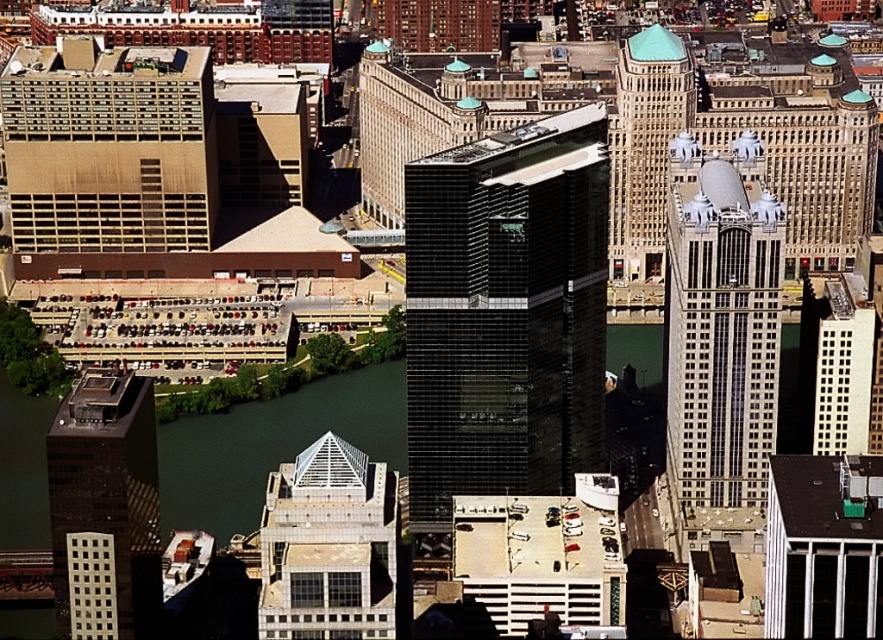
Measure the distance between point (570, 376) and camera.

Point (570, 376) and camera are 648.33 meters apart.

Is black glass skyscraper at center further to camera compared to matte glass skyscraper at upper right?

No.

What are the coordinates of `black glass skyscraper at center` in the screenshot? It's located at (506, 314).

Is point (518, 467) closer to camera compared to point (272, 518)?

Yes.

Does black glass skyscraper at center lie behind glass pyramid at center?

No.

Who is more forward, [512,376] or [336,540]?

Point [512,376] is in front.

Identify the location of black glass skyscraper at center. Image resolution: width=883 pixels, height=640 pixels. (506, 314).

Does matte glass skyscraper at upper right appear on the left side of white glass building at center-right?

Indeed, matte glass skyscraper at upper right is positioned on the left side of white glass building at center-right.

Between point (620, 115) and point (834, 356), which one is positioned in front?

Point (620, 115) is in front.

In order to click on matte glass skyscraper at upper right in this screenshot , I will do `click(645, 145)`.